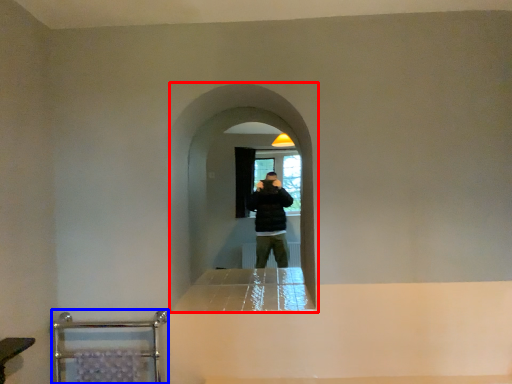
Question: Which object appears farthest to the camera in this image, screen door (highlighted by a red box) or balustrade (highlighted by a blue box)?

Choices:
 (A) screen door
 (B) balustrade

Answer: (A)